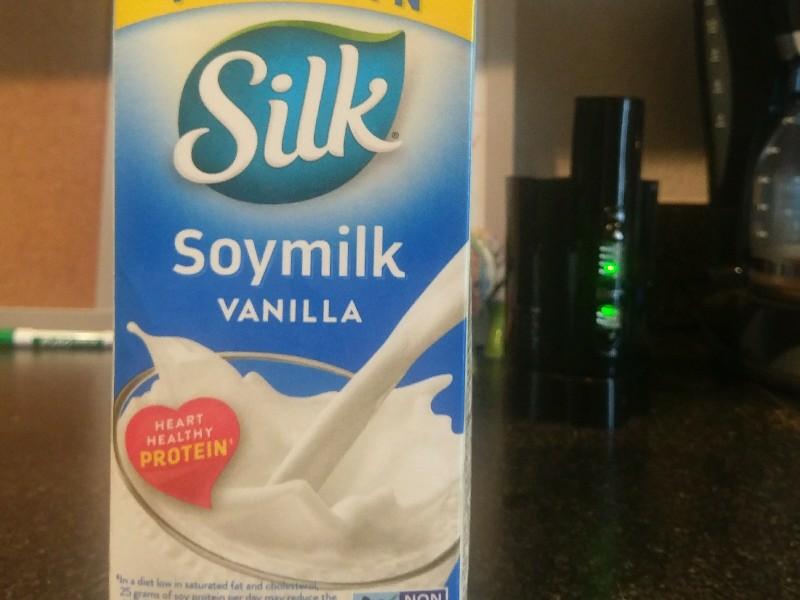
This screenshot has width=800, height=600. What are the coordinates of `coffee pot` in the screenshot? It's located at (774, 187).